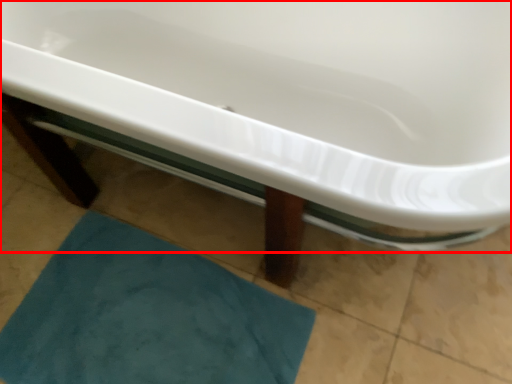
Question: From the image's perspective, considering the relative positions of bathtub (annotated by the red box) and bath mat in the image provided, where is bathtub (annotated by the red box) located with respect to the staircase?

Choices:
 (A) above
 (B) below

Answer: (A)